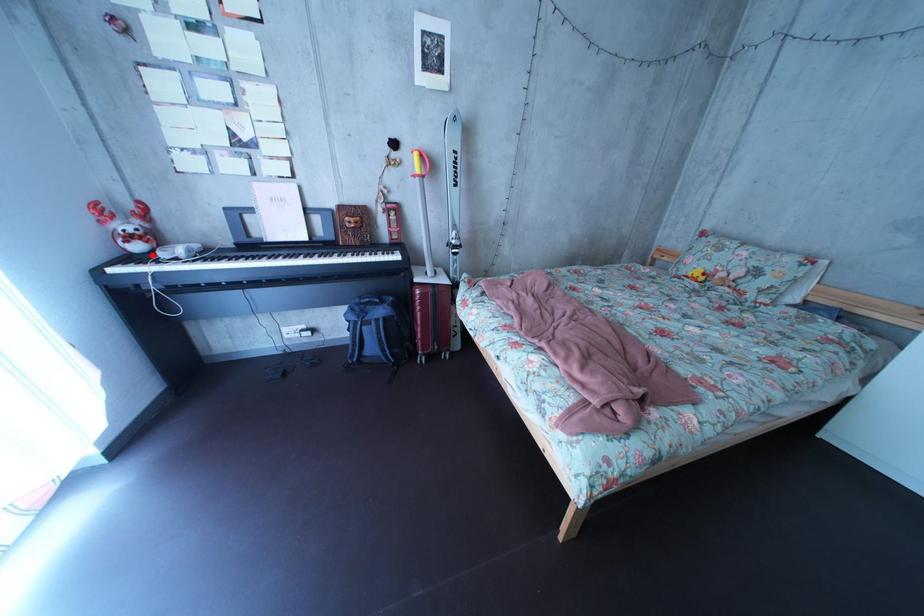
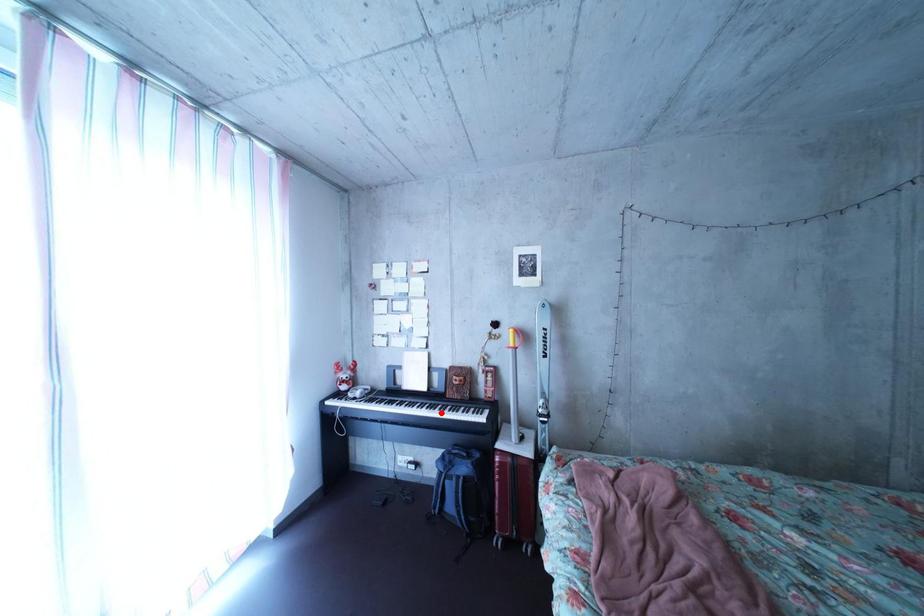
I am providing you with two images of the same scene from different viewpoints. A red point is marked on the first image and another point is marked on the second image. Are the points marked in image1 and image2 representing the same 3D position?

No